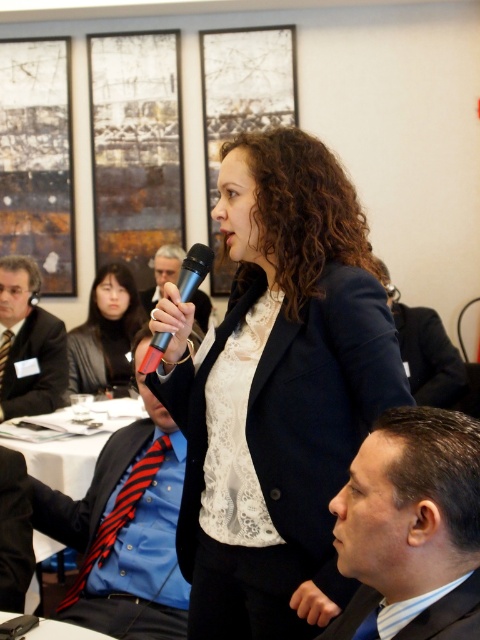
You are an event planner arranging seating for a conference. You notice the dark blue suit at center and the blue striped fabric at lower right in the image. Which object is positioned higher in the image?

The dark blue suit at center is positioned higher than the blue striped fabric at lower right.

You are organizing a conference and need to place two microphones on a table. The metallic silver microphone at center needs to be positioned to the right of the matte black microphone at center. Is this arrangement possible based on the scene description?

Yes, the arrangement is possible because the metallic silver microphone at center is already positioned to the right of the matte black microphone at center as per the scene description.

You are organizing a charity event and need to arrange seating based on the width of attendees clothing. If the navy blue fabric business suit at center and the blue striped fabric at lower right are the only two options, which clothing should be seated in a wider seat to accommodate their clothing?

The navy blue fabric business suit at center should be seated in a wider seat since its width is larger than the blue striped fabric at lower right.